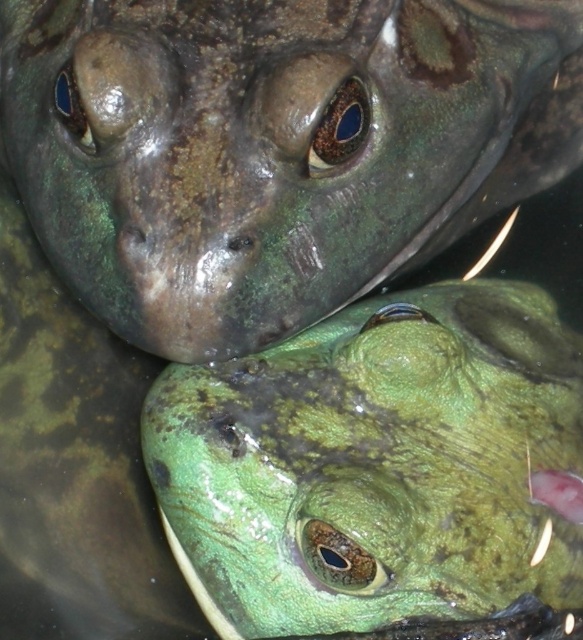
Does green matte skin at upper center have a lesser width compared to green matte skin at center?

Incorrect, green matte skin at upper center's width is not less than green matte skin at center's.

Who is more distant from viewer, (255,51) or (189,483)?

Point (189,483)

I want to click on green matte skin at upper center, so click(273, 147).